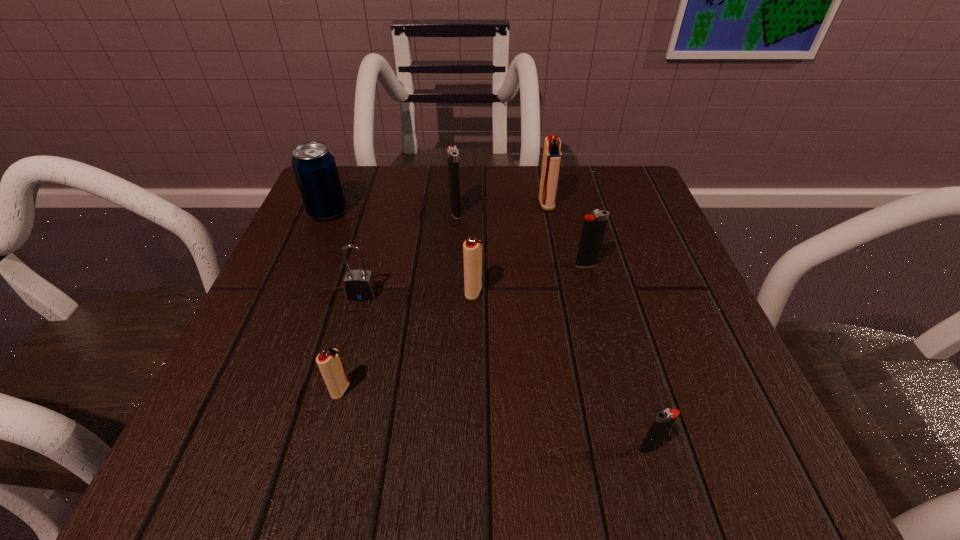
The height and width of the screenshot is (540, 960). Find the location of `free space between the farthest red igniter and the third igniter from left to right`. free space between the farthest red igniter and the third igniter from left to right is located at coordinates (510, 248).

Where is `free space between the soda can and the third igniter from right to left`? This screenshot has width=960, height=540. free space between the soda can and the third igniter from right to left is located at coordinates (437, 208).

Identify the location of vacant space in between the smallest black igniter and the fourth object from left to right. (552, 330).

What are the coordinates of `vacant point located between the fifth farthest igniter and the padlock` in the screenshot? It's located at (351, 342).

Find the location of a particular element. This screenshot has width=960, height=540. free space that is in between the leftmost object and the fifth object from right to left is located at coordinates (392, 212).

You are a GUI agent. You are given a task and a screenshot of the screen. Output one action in this format:
    pyautogui.click(x=<x>, y=<y>)
    Task: Click on the object that is the fourth closest to the nearest object
    This screenshot has height=540, width=960.
    Given the screenshot: What is the action you would take?
    pyautogui.click(x=359, y=285)

At what (x,y) coordinates should I click in order to perform the action: click on object that ranks as the seventh closest to the farthest black igniter. Please return your answer as a coordinate pair (x, y). The width and height of the screenshot is (960, 540). Looking at the image, I should click on (664, 420).

Locate which igniter is the third closest to the nearest object. Please provide its 2D coordinates. Your answer should be formatted as a tuple, i.e. [(x, y)], where the tuple contains the x and y coordinates of a point satisfying the conditions above.

[(329, 362)]

Locate an element on the screen. The image size is (960, 540). igniter that is the fifth closest to the padlock is located at coordinates (552, 156).

At what (x,y) coordinates should I click in order to perform the action: click on red igniter identified as the closest to the soda can. Please return your answer as a coordinate pair (x, y). This screenshot has height=540, width=960. Looking at the image, I should click on (x=472, y=248).